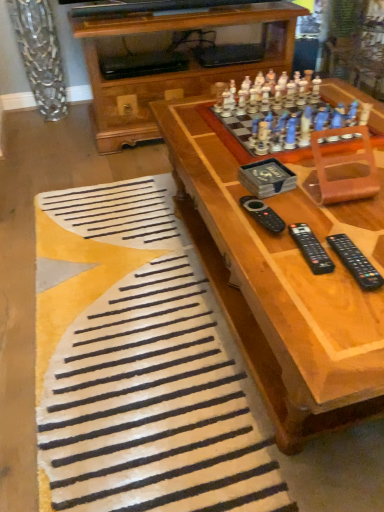
The image size is (384, 512). I want to click on free space to the left of black plastic remote at lower right, the 3th remote viewed from the left, so click(279, 267).